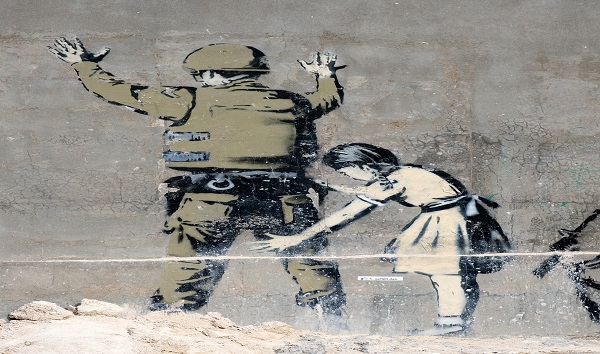
The height and width of the screenshot is (354, 600). In order to click on smooth grey wall in this screenshot , I will do `click(466, 31)`.